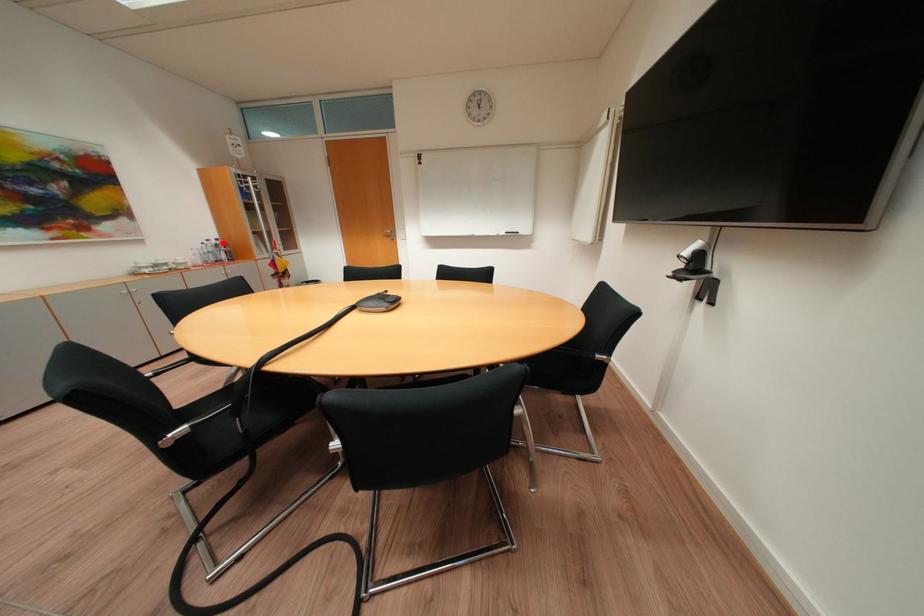
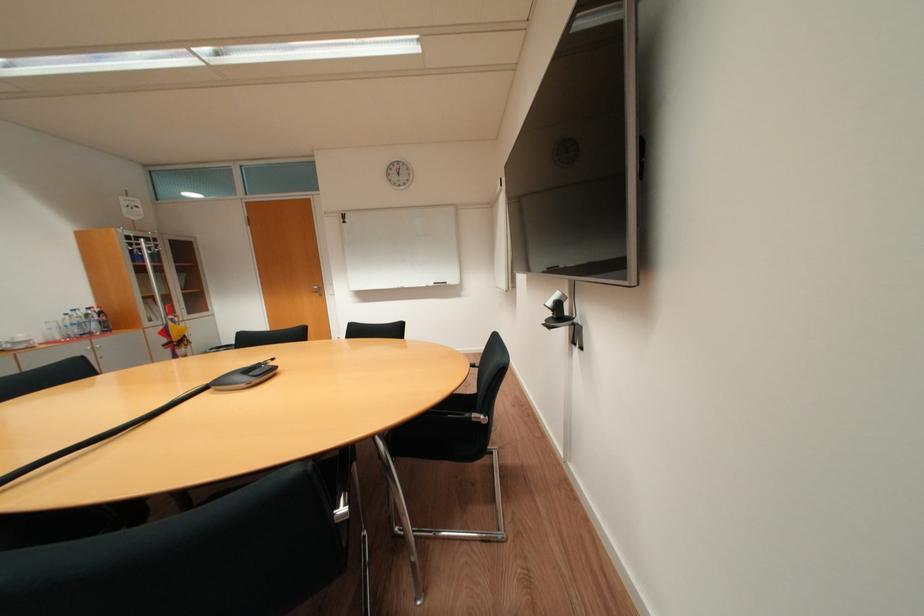
Where in the second image is the point corresponding to the highlighted location from the first image?

(92, 313)